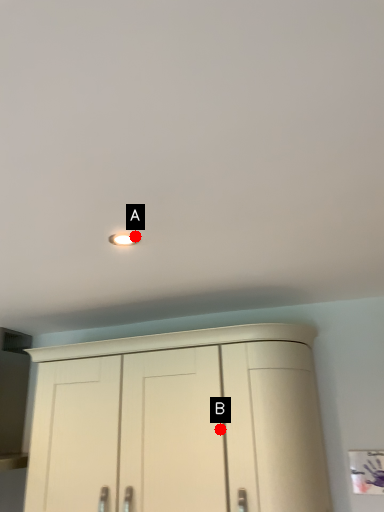
Question: Two points are circled on the image, labeled by A and B beside each circle. Which point is further to the camera?

Choices:
 (A) A is further
 (B) B is further

Answer: (B)